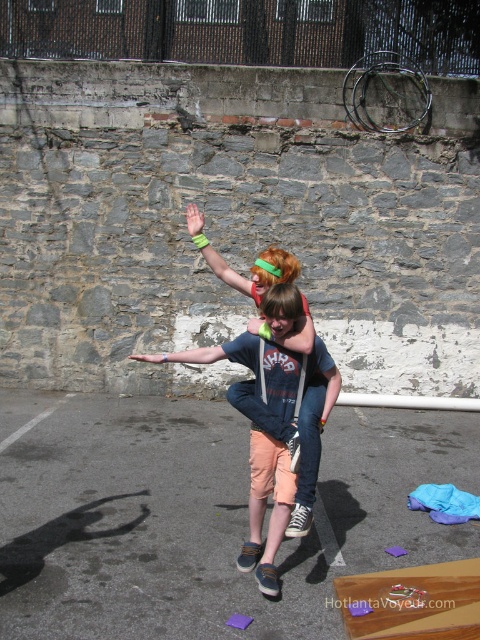
Consider the image. You are a photographer trying to capture a candid shot of the two people in the scene. You want to ensure that both the denim shorts at center and the smooth skin hand at center are in focus simultaneously. Given that your camera has a depth of field range of 12 feet, will you be able to achieve this?

The denim shorts at center and smooth skin hand at center are 13.03 feet apart from each other. Since the camera has a depth of field range of 12 feet, which is shorter than the distance between them, you will not be able to have both in focus at the same time.

You are a photographer trying to capture a closeup shot of the green rubber wristband at upper center while also including the denim shorts at center in the frame. Based on their positions, will you need to adjust your camera angle to focus on the wristband without cropping the shorts out?

The denim shorts at center is closer to the viewer than the green rubber wristband at upper center. To focus on the wristband without cropping the shorts, you might need to adjust the camera angle slightly backward to ensure both are in frame while focusing on the farther wristband.